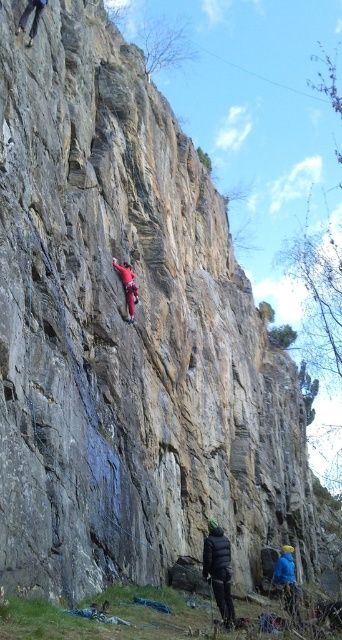
Question: Does black puffy jacket at lower center have a larger size compared to red climbing suit at center?

Choices:
 (A) no
 (B) yes

Answer: (B)

Question: Can you confirm if black puffy jacket at lower center is positioned to the left of red climbing suit at center?

Choices:
 (A) no
 (B) yes

Answer: (A)

Question: Which point is closer to the camera?

Choices:
 (A) black puffy jacket at lower center
 (B) red climbing suit at center

Answer: (A)

Question: Which object appears closest to the camera in this image?

Choices:
 (A) black puffy jacket at lower center
 (B) red climbing suit at center

Answer: (A)

Question: Which of the following is the closest to the observer?

Choices:
 (A) (132, 312)
 (B) (217, 598)

Answer: (B)

Question: Does black puffy jacket at lower center have a larger size compared to red climbing suit at center?

Choices:
 (A) no
 (B) yes

Answer: (B)